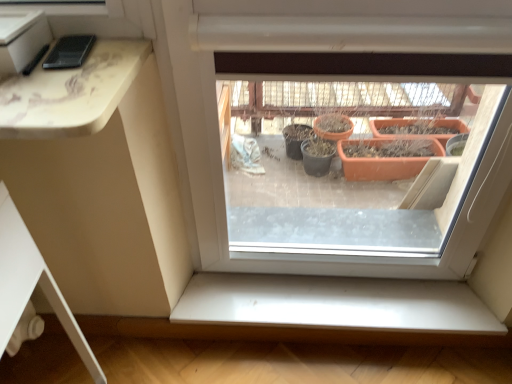
Question: Is white smooth window sill at lower center taller or shorter than matte black phone at upper left?

Choices:
 (A) tall
 (B) short

Answer: (A)

Question: Is white smooth window sill at lower center to the left or to the right of matte black phone at upper left in the image?

Choices:
 (A) right
 (B) left

Answer: (A)

Question: From the image's perspective, is white smooth window sill at lower center above or below matte black phone at upper left?

Choices:
 (A) above
 (B) below

Answer: (B)

Question: Is point (31, 43) closer or farther from the camera than point (403, 317)?

Choices:
 (A) farther
 (B) closer

Answer: (B)

Question: In the image, is matte black phone at upper left on the left side or the right side of white smooth window sill at lower center?

Choices:
 (A) right
 (B) left

Answer: (B)

Question: From a real-world perspective, is matte black phone at upper left above or below white smooth window sill at lower center?

Choices:
 (A) below
 (B) above

Answer: (B)

Question: From the image's perspective, is matte black phone at upper left above or below white smooth window sill at lower center?

Choices:
 (A) below
 (B) above

Answer: (B)